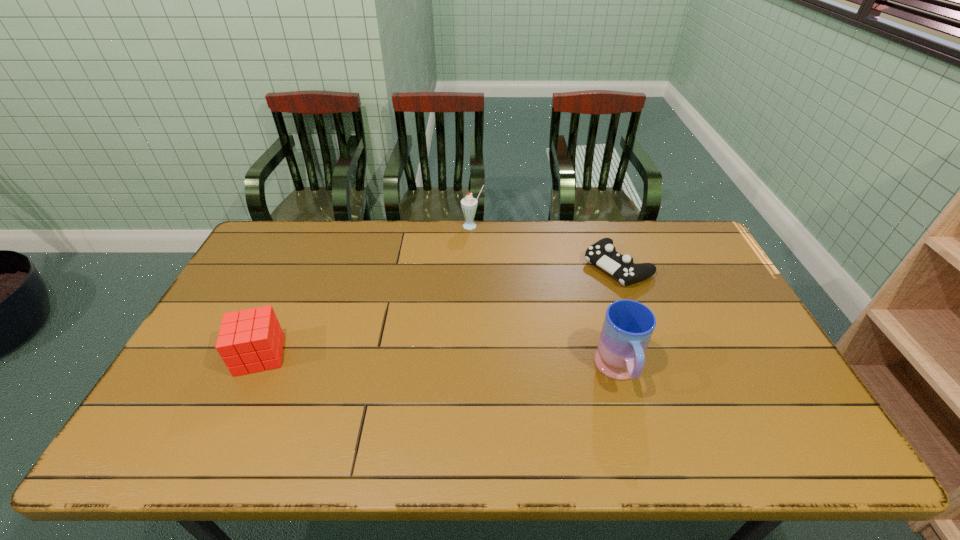
The width and height of the screenshot is (960, 540). Identify the location of vacant spot on the desktop that is between the cube and the mug and is positioned on the surface of the control. (461, 364).

Locate an element on the screen. Image resolution: width=960 pixels, height=540 pixels. vacant space on the desktop that is between the cube and the mug and is positioned on the straw side of the milkshake is located at coordinates (445, 363).